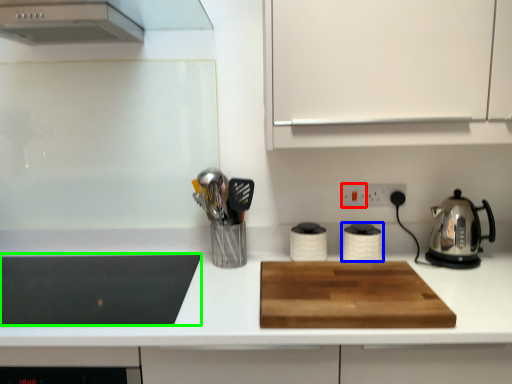
Question: Which is farther away from electric outlet (highlighted by a red box)? kitchen appliance (highlighted by a blue box) or kitchen appliance (highlighted by a green box)?

Choices:
 (A) kitchen appliance
 (B) kitchen appliance

Answer: (B)